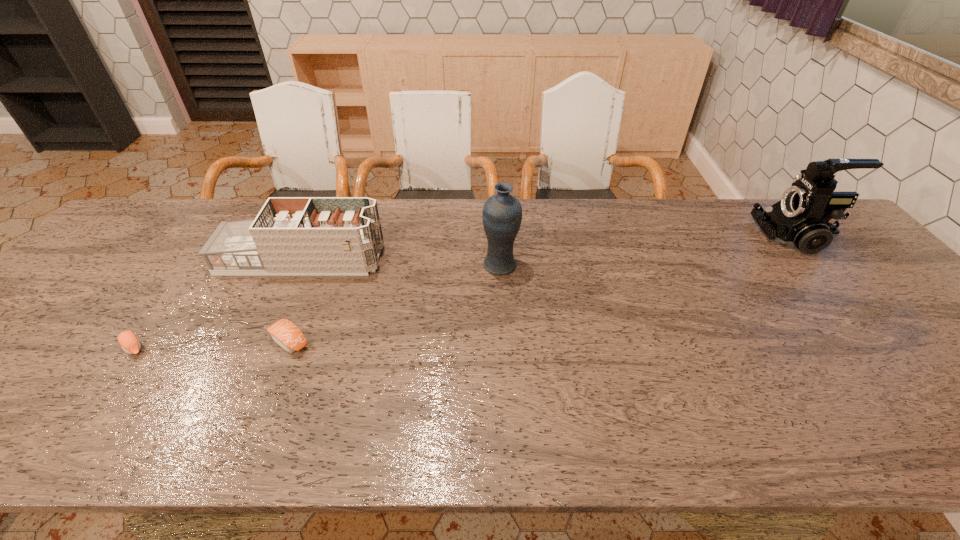
The width and height of the screenshot is (960, 540). Identify the location of vacant space at the right edge. (833, 271).

Identify the location of unoccupied position between the camcorder and the right sushi. This screenshot has width=960, height=540. (542, 288).

Locate an element on the screen. The width and height of the screenshot is (960, 540). vacant space in between the vase and the camcorder is located at coordinates (648, 251).

I want to click on empty location between the shortest object and the fourth tallest object, so click(212, 344).

The image size is (960, 540). In order to click on empty space that is in between the camcorder and the third shortest object in this screenshot , I will do `click(548, 247)`.

Image resolution: width=960 pixels, height=540 pixels. What are the coordinates of `vacant area between the fourth tallest object and the rightmost object` in the screenshot? It's located at (542, 288).

Locate an element on the screen. vacant space in between the second object from right to left and the third shortest object is located at coordinates (400, 262).

Locate an element on the screen. The image size is (960, 540). free area in between the camcorder and the taller sushi is located at coordinates (542, 288).

Where is `free space between the vase and the third shortest object`? The width and height of the screenshot is (960, 540). free space between the vase and the third shortest object is located at coordinates (400, 262).

Where is `empty location between the shorter sushi and the rightmost object`? empty location between the shorter sushi and the rightmost object is located at coordinates (465, 292).